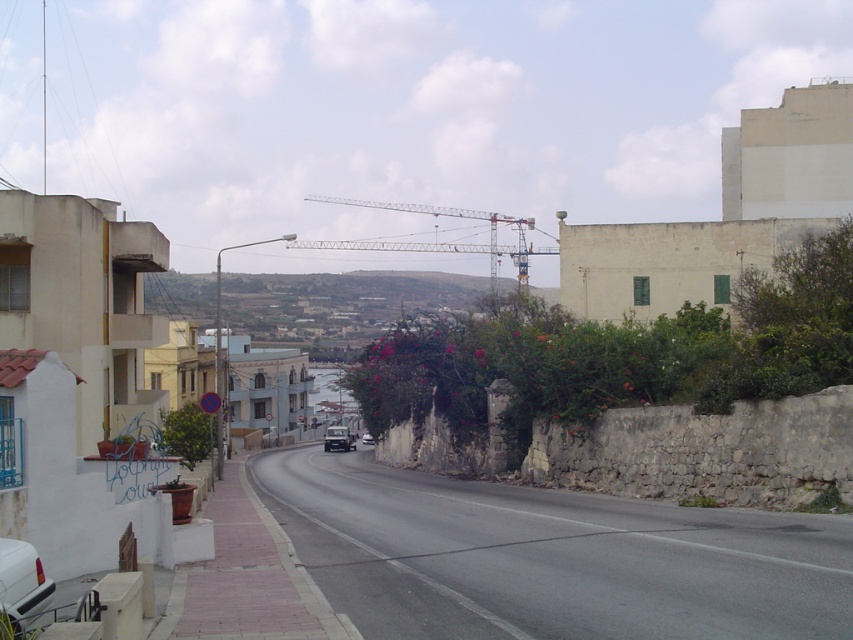
Between metallic gray crane at center and white matte car at lower left, which one has more height?

Standing taller between the two is metallic gray crane at center.

Does point (338, 241) come farther from viewer compared to point (33, 614)?

That is True.

Between point (485, 250) and point (10, 593), which one is positioned behind?

The point (485, 250) is more distant.

Where is `metallic gray crane at center`? metallic gray crane at center is located at coordinates (442, 243).

Is metallic gray crane at center smaller than white glossy car at center?

Actually, metallic gray crane at center might be larger than white glossy car at center.

Between point (521, 280) and point (370, 440), which one is positioned behind?

Positioned behind is point (370, 440).

Where is `metallic gray crane at center`? The height and width of the screenshot is (640, 853). metallic gray crane at center is located at coordinates (442, 243).

Which is in front, point (20, 541) or point (323, 445)?

Point (20, 541)

Does point (25, 593) come behind point (338, 432)?

No, it is in front of (338, 432).

At what (x,y) coordinates should I click in order to perform the action: click on white matte car at lower left. Please return your answer as a coordinate pair (x, y). Image resolution: width=853 pixels, height=640 pixels. Looking at the image, I should click on (22, 582).